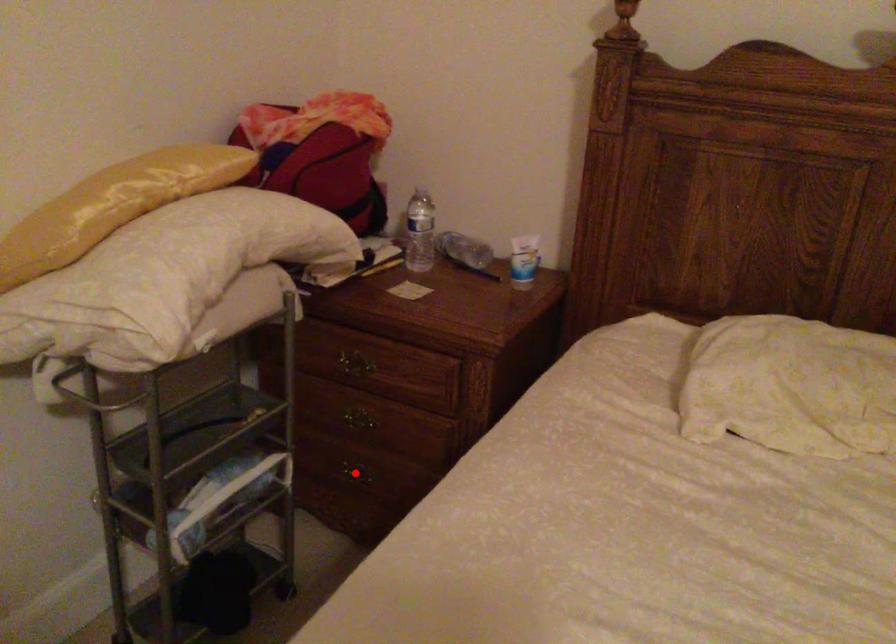
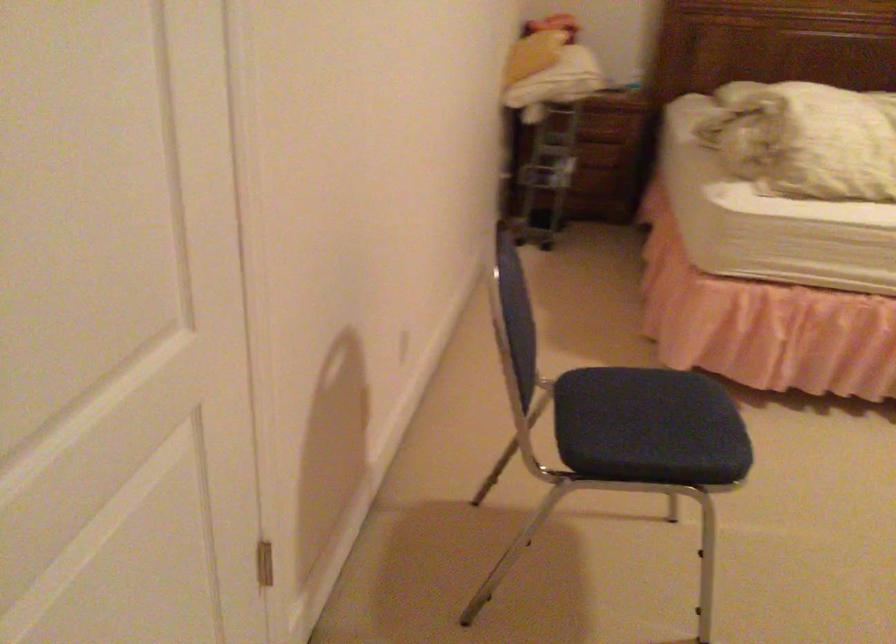
Question: I am providing you with two images of the same scene from different viewpoints. A red point is marked on the first image. Can you still see the location of the red point in image 2?

Choices:
 (A) Yes
 (B) No

Answer: (B)